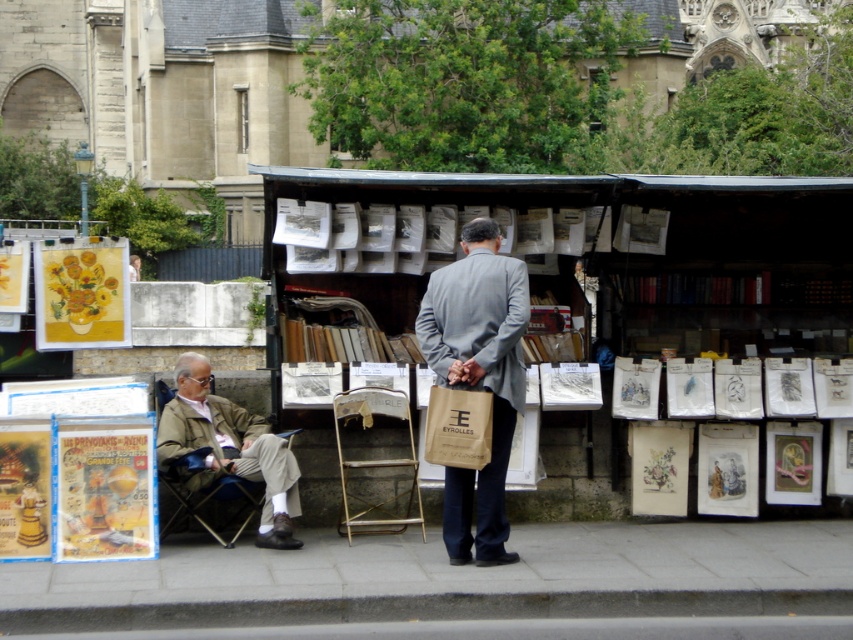
Can you confirm if gray concrete pavement at lower center is positioned to the right of metallic gold folding chair at center?

Indeed, gray concrete pavement at lower center is positioned on the right side of metallic gold folding chair at center.

Between point (759, 522) and point (334, 404), which one is positioned behind?

Positioned behind is point (759, 522).

Image resolution: width=853 pixels, height=640 pixels. I want to click on gray concrete pavement at lower center, so click(x=450, y=579).

Does gray fabric suit at center appear on the right side of khaki fabric jacket at left?

Indeed, gray fabric suit at center is positioned on the right side of khaki fabric jacket at left.

Describe the element at coordinates (479, 376) in the screenshot. I see `gray fabric suit at center` at that location.

Between point (469, 266) and point (248, 449), which one is positioned in front?

Point (469, 266)

The width and height of the screenshot is (853, 640). Find the location of `gray fabric suit at center`. gray fabric suit at center is located at coordinates (479, 376).

How far apart are khaki fabric jacket at left and metallic gold folding chair at center?

khaki fabric jacket at left and metallic gold folding chair at center are 29.89 inches apart from each other.

In the scene shown: Is khaki fabric jacket at left further to camera compared to metallic gold folding chair at center?

That is False.

Is point (231, 440) more distant than point (396, 397)?

No, it is not.

Locate an element on the screen. This screenshot has height=640, width=853. khaki fabric jacket at left is located at coordinates (229, 448).